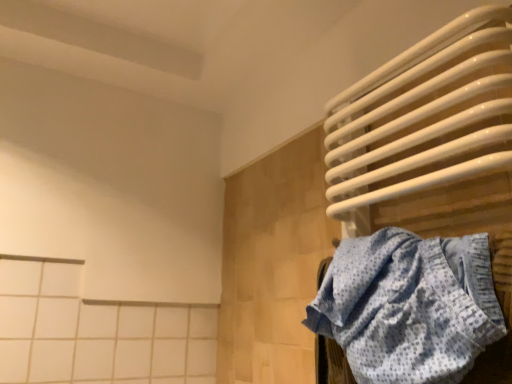
Question: Does white glossy towel rack at upper right have a lesser width compared to blue dotted fabric at right?

Choices:
 (A) no
 (B) yes

Answer: (B)

Question: Does white glossy towel rack at upper right have a greater width compared to blue dotted fabric at right?

Choices:
 (A) no
 (B) yes

Answer: (A)

Question: Can you confirm if white glossy towel rack at upper right is shorter than blue dotted fabric at right?

Choices:
 (A) yes
 (B) no

Answer: (B)

Question: Is white glossy towel rack at upper right facing away from blue dotted fabric at right?

Choices:
 (A) yes
 (B) no

Answer: (A)

Question: From a real-world perspective, is white glossy towel rack at upper right positioned under blue dotted fabric at right based on gravity?

Choices:
 (A) no
 (B) yes

Answer: (A)

Question: Is white glossy towel rack at upper right in contact with blue dotted fabric at right?

Choices:
 (A) yes
 (B) no

Answer: (B)

Question: Are blue dotted fabric at right and white glossy towel rack at upper right making contact?

Choices:
 (A) no
 (B) yes

Answer: (A)

Question: Is blue dotted fabric at right oriented towards white glossy towel rack at upper right?

Choices:
 (A) yes
 (B) no

Answer: (B)

Question: Is blue dotted fabric at right to the right of white glossy towel rack at upper right from the viewer's perspective?

Choices:
 (A) yes
 (B) no

Answer: (B)

Question: Can you confirm if blue dotted fabric at right is shorter than white glossy towel rack at upper right?

Choices:
 (A) no
 (B) yes

Answer: (B)

Question: Considering the relative sizes of blue dotted fabric at right and white glossy towel rack at upper right in the image provided, is blue dotted fabric at right thinner than white glossy towel rack at upper right?

Choices:
 (A) no
 (B) yes

Answer: (A)

Question: From a real-world perspective, is blue dotted fabric at right beneath white glossy towel rack at upper right?

Choices:
 (A) no
 (B) yes

Answer: (B)

Question: Does point (331, 261) appear closer or farther from the camera than point (435, 34)?

Choices:
 (A) closer
 (B) farther

Answer: (B)